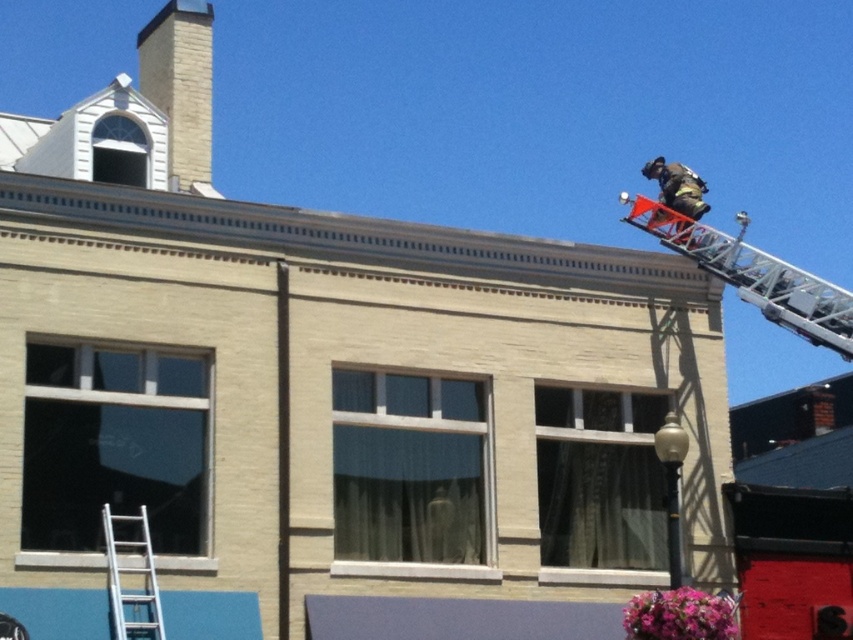
You are a safety inspector assessing the scene. You notice the silver metallic ladder at lower left and the reflective silver helmet at upper right. Which object is closer to the ground?

The silver metallic ladder at lower left is closer to the ground because it has a lesser height compared to the reflective silver helmet at upper right.

You are a firefighter trying to reach the dormer window on the roof. You see an orange metallic ladder at upper right and a reflective silver helmet at upper right. Which object is closer to the dormer window?

The reflective silver helmet at upper right is closer to the dormer window because it is positioned above the orange metallic ladder at upper right.